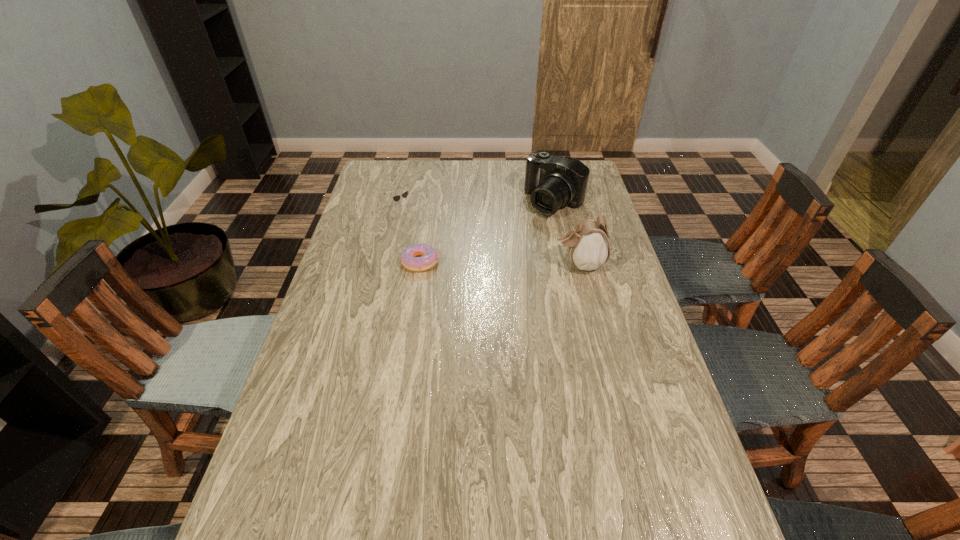
Locate an element on the screen. free space that is in between the doughnut and the pouch is located at coordinates (500, 263).

I want to click on blank region between the pouch and the doughnut, so click(x=500, y=263).

Locate an element on the screen. vacant area that lies between the sunglasses and the camera is located at coordinates (478, 205).

Point out which object is positioned as the third nearest to the third tallest object. Please provide its 2D coordinates. Your answer should be formatted as a tuple, i.e. [(x, y)], where the tuple contains the x and y coordinates of a point satisfying the conditions above.

[(588, 244)]

The height and width of the screenshot is (540, 960). I want to click on object that stands as the third closest to the third tallest object, so click(x=588, y=244).

This screenshot has width=960, height=540. What are the coordinates of `vacant region that satisfies the following two spatial constraints: 1. on the back side of the camera; 2. on the right side of the sunglasses` in the screenshot? It's located at (404, 202).